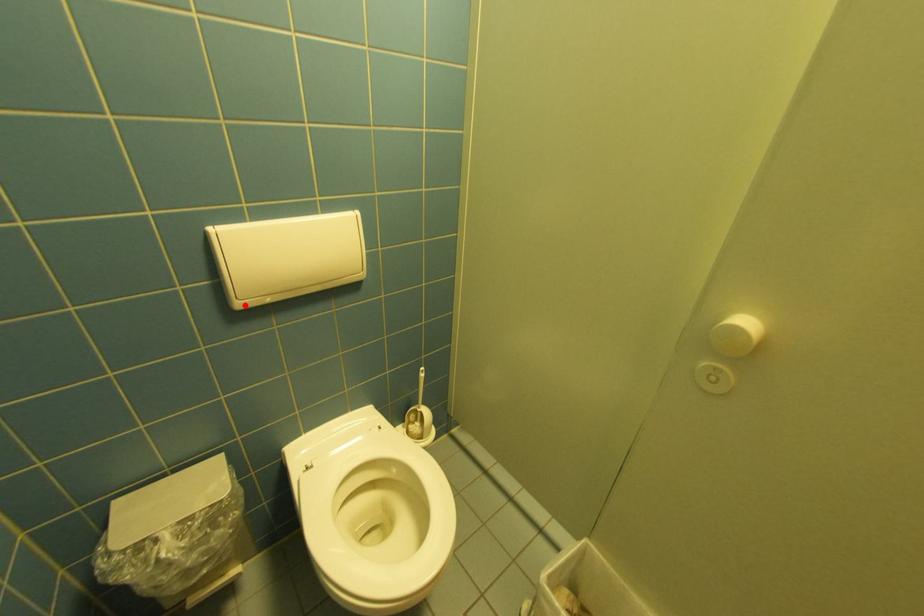
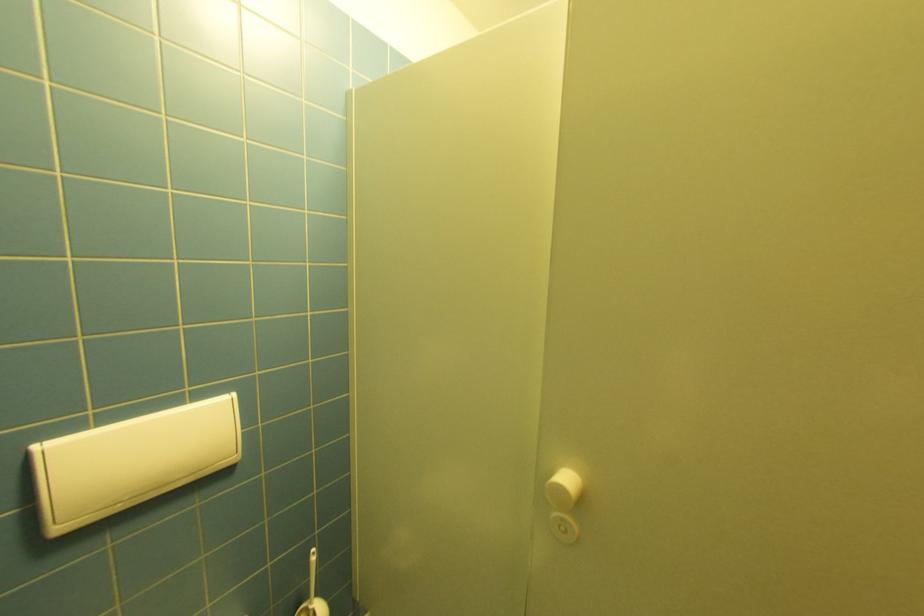
Where in the second image is the point corresponding to the highlighted location from the first image?

(66, 530)